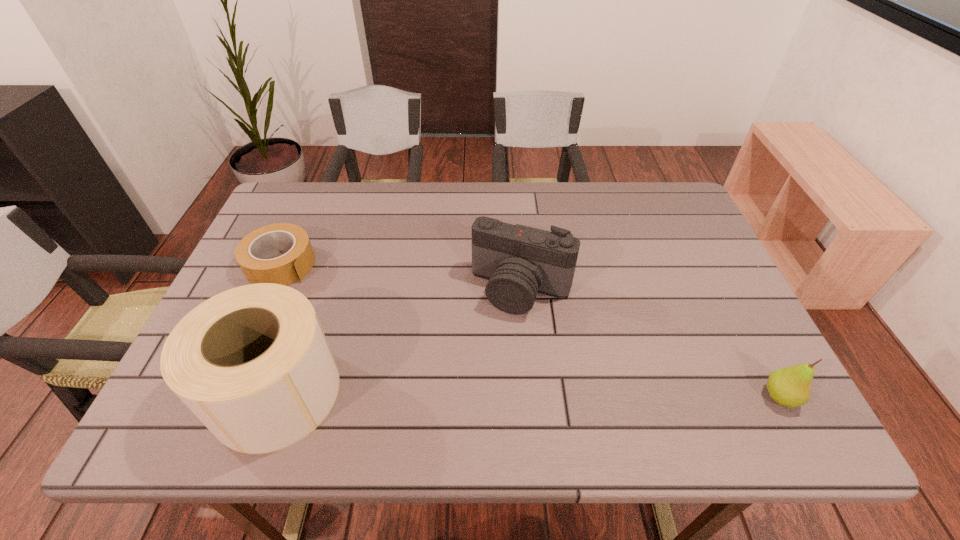
The height and width of the screenshot is (540, 960). Identify the location of toilet tissue. (252, 363).

Find the location of `the rightmost object`. the rightmost object is located at coordinates (790, 386).

Locate an element on the screen. The width and height of the screenshot is (960, 540). pear is located at coordinates (790, 386).

You are a GUI agent. You are given a task and a screenshot of the screen. Output one action in this format:
    pyautogui.click(x=<x>, y=<y>)
    Task: Click on the camera
    This screenshot has width=960, height=540.
    Given the screenshot: What is the action you would take?
    pyautogui.click(x=519, y=261)

Find the location of `duct tape`. duct tape is located at coordinates (251, 251).

Where is `free region located on the back of the toilet tissue`? free region located on the back of the toilet tissue is located at coordinates (310, 299).

Identify the location of vacant region located at the lens of the camera. (494, 345).

I want to click on vacant area located 0.060m at the lens of the camera, so click(497, 338).

At what (x,y) coordinates should I click in order to perform the action: click on vacant position located at the lens of the camera. Please return your answer as a coordinate pair (x, y). The height and width of the screenshot is (540, 960). Looking at the image, I should click on (476, 389).

Locate an element on the screen. This screenshot has width=960, height=540. free region located at the edge of the shortest object is located at coordinates (379, 335).